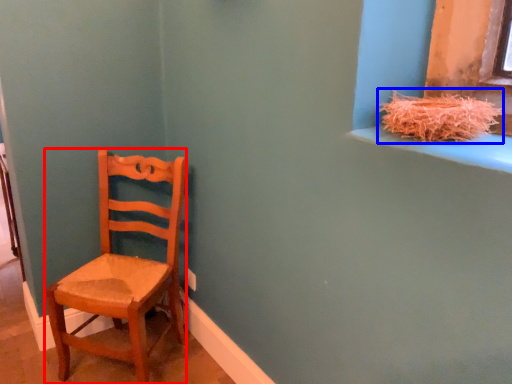
Question: Which object appears farthest to the camera in this image, chair (highlighted by a red box) or straw (highlighted by a blue box)?

Choices:
 (A) chair
 (B) straw

Answer: (A)